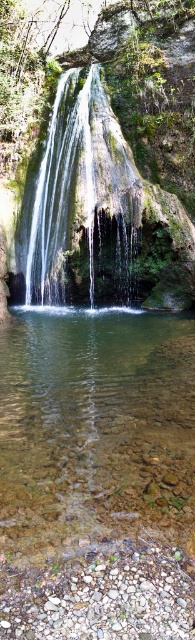
Question: Is clear water at center thinner than smooth gray rock at bottom center?

Choices:
 (A) no
 (B) yes

Answer: (A)

Question: Which object is the farthest from the smooth gray rock at bottom center?

Choices:
 (A) clear glass water at center
 (B) clear water at center

Answer: (B)

Question: Based on their relative distances, which object is farther from the clear water at center?

Choices:
 (A) clear glass water at center
 (B) smooth gray rock at bottom center

Answer: (B)

Question: Can you confirm if clear glass water at center is bigger than clear water at center?

Choices:
 (A) yes
 (B) no

Answer: (B)

Question: Is clear glass water at center in front of smooth gray rock at bottom center?

Choices:
 (A) yes
 (B) no

Answer: (B)

Question: Which object is farther from the camera taking this photo?

Choices:
 (A) clear water at center
 (B) clear glass water at center

Answer: (A)